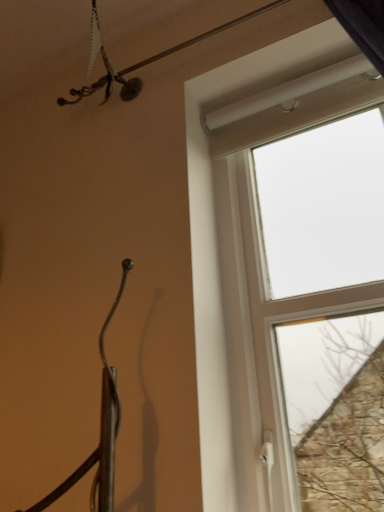
What is the approximate width of metallic wire at upper center?

metallic wire at upper center is 7.31 centimeters in width.

Measure the distance between point (125, 70) and camera.

They are 1.24 meters apart.

This screenshot has height=512, width=384. Identify the location of metallic wire at upper center. (141, 61).

This screenshot has width=384, height=512. Describe the element at coordinates (141, 61) in the screenshot. I see `metallic wire at upper center` at that location.

Image resolution: width=384 pixels, height=512 pixels. What do you see at coordinates (251, 261) in the screenshot? I see `white plastic window at upper right` at bounding box center [251, 261].

Where is `white plastic window at upper right`? The image size is (384, 512). white plastic window at upper right is located at coordinates (251, 261).

Image resolution: width=384 pixels, height=512 pixels. Identify the location of metallic wire at upper center. (141, 61).

Considering the positions of objects white plastic window at upper right and metallic wire at upper center in the image provided, who is more to the left, white plastic window at upper right or metallic wire at upper center?

Positioned to the left is metallic wire at upper center.

Does white plastic window at upper right lie in front of metallic wire at upper center?

Yes, white plastic window at upper right is closer to the camera.

Which point is more forward, (264, 75) or (132, 90)?

Positioned in front is point (264, 75).

From the image's perspective, relative to metallic wire at upper center, is white plastic window at upper right above or below?

From the image's perspective, white plastic window at upper right appears below metallic wire at upper center.

From a real-world perspective, relative to metallic wire at upper center, is white plastic window at upper right vertically above or below?

white plastic window at upper right is below metallic wire at upper center.

Which of these two, white plastic window at upper right or metallic wire at upper center, is wider?

With larger width is metallic wire at upper center.

Who is shorter, white plastic window at upper right or metallic wire at upper center?

metallic wire at upper center.

Considering the sizes of white plastic window at upper right and metallic wire at upper center in the image, is white plastic window at upper right bigger or smaller than metallic wire at upper center?

white plastic window at upper right is bigger than metallic wire at upper center.

Would you say white plastic window at upper right is outside metallic wire at upper center?

Indeed, white plastic window at upper right is completely outside metallic wire at upper center.

Are white plastic window at upper right and metallic wire at upper center located far from each other?

white plastic window at upper right is near metallic wire at upper center, not far away.

Is white plastic window at upper right aimed at metallic wire at upper center?

Yes, white plastic window at upper right is facing metallic wire at upper center.

I want to click on window below the metallic wire at upper center (from a real-world perspective), so click(x=251, y=261).

Is metallic wire at upper center to the left of white plastic window at upper right from the viewer's perspective?

Correct, you'll find metallic wire at upper center to the left of white plastic window at upper right.

Is the depth of metallic wire at upper center less than that of white plastic window at upper right?

No, it is not.

Does point (128, 97) appear closer or farther from the camera than point (192, 143)?

Point (128, 97) is positioned farther from the camera compared to point (192, 143).

From the image's perspective, is metallic wire at upper center over white plastic window at upper right?

Indeed, from the image's perspective, metallic wire at upper center is shown above white plastic window at upper right.

From a real-world perspective, is metallic wire at upper center physically above white plastic window at upper right?

Yes, from a real-world perspective, metallic wire at upper center is on top of white plastic window at upper right.

Considering the relative sizes of metallic wire at upper center and white plastic window at upper right in the image provided, is metallic wire at upper center wider than white plastic window at upper right?

Yes.

Considering the relative sizes of metallic wire at upper center and white plastic window at upper right in the image provided, is metallic wire at upper center taller than white plastic window at upper right?

In fact, metallic wire at upper center may be shorter than white plastic window at upper right.

Between metallic wire at upper center and white plastic window at upper right, which one has larger size?

white plastic window at upper right is bigger.

Which is correct: metallic wire at upper center is inside white plastic window at upper right, or outside of it?

metallic wire at upper center lies outside white plastic window at upper right.

Is metallic wire at upper center far from white plastic window at upper right?

No, metallic wire at upper center is in close proximity to white plastic window at upper right.

Is metallic wire at upper center oriented towards white plastic window at upper right?

No, metallic wire at upper center is not facing towards white plastic window at upper right.

How different are the orientations of metallic wire at upper center and white plastic window at upper right in degrees?

They differ by 0.139 degrees in their facing directions.

You are a GUI agent. You are given a task and a screenshot of the screen. Output one action in this format:
    pyautogui.click(x=<x>, y=<y>)
    Task: Click on the wire located behind the white plastic window at upper right
    Image resolution: width=384 pixels, height=512 pixels.
    Given the screenshot: What is the action you would take?
    pyautogui.click(x=141, y=61)

Locate an element on the screen. The height and width of the screenshot is (512, 384). window below the metallic wire at upper center (from a real-world perspective) is located at coordinates (251, 261).

The width and height of the screenshot is (384, 512). Identify the location of wire on the left of white plastic window at upper right. (141, 61).